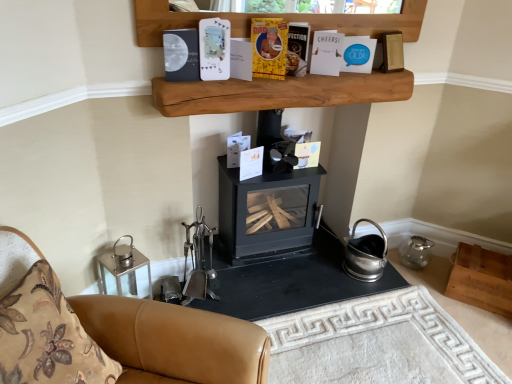
Question: From a real-world perspective, is black matte wood burning stove at center positioned over matte black book at upper center, which is the sixth paperback book in right-to-left order, based on gravity?

Choices:
 (A) no
 (B) yes

Answer: (A)

Question: Is black matte wood burning stove at center at the right side of matte black book at upper center, marked as the 1th paperback book in a left-to-right arrangement?

Choices:
 (A) no
 (B) yes

Answer: (B)

Question: Could you tell me if black matte wood burning stove at center is turned towards matte black book at upper center, which is the sixth paperback book in right-to-left order?

Choices:
 (A) yes
 (B) no

Answer: (B)

Question: Is black matte wood burning stove at center taller than matte black book at upper center, marked as the 1th paperback book in a left-to-right arrangement?

Choices:
 (A) yes
 (B) no

Answer: (A)

Question: Is black matte wood burning stove at center oriented away from matte black book at upper center, which is the sixth paperback book in right-to-left order?

Choices:
 (A) yes
 (B) no

Answer: (B)

Question: Is black matte wood burning stove at center beside matte black book at upper center, which is the sixth paperback book in right-to-left order?

Choices:
 (A) yes
 (B) no

Answer: (B)

Question: Does yellow paper at upper center, which is counted as the 4th paperback book, starting from the right, have a lesser height compared to white matte paper at upper center, which is the 2th paperback book from left to right?

Choices:
 (A) no
 (B) yes

Answer: (B)

Question: Is yellow paper at upper center, which is the 3th paperback book in left-to-right order, bigger than white matte paper at upper center, which is the 2th paperback book from left to right?

Choices:
 (A) no
 (B) yes

Answer: (B)

Question: Would you say yellow paper at upper center, which is the 3th paperback book in left-to-right order, is a long distance from white matte paper at upper center, which is the 2th paperback book from left to right?

Choices:
 (A) yes
 (B) no

Answer: (B)

Question: From a real-world perspective, is yellow paper at upper center, which is the 3th paperback book in left-to-right order, located higher than white matte paper at upper center, positioned as the 5th paperback book in right-to-left order?

Choices:
 (A) no
 (B) yes

Answer: (A)

Question: From a real-world perspective, is yellow paper at upper center, which is the 3th paperback book in left-to-right order, beneath white matte paper at upper center, positioned as the 5th paperback book in right-to-left order?

Choices:
 (A) yes
 (B) no

Answer: (A)

Question: Can you confirm if yellow paper at upper center, which is the 3th paperback book in left-to-right order, is taller than white matte paper at upper center, which is the 2th paperback book from left to right?

Choices:
 (A) yes
 (B) no

Answer: (B)

Question: Is wooden box at lower right, the 2th shelf viewed from the top, smaller than blue paper at upper center, the 6th paperback book positioned from the left?

Choices:
 (A) no
 (B) yes

Answer: (A)